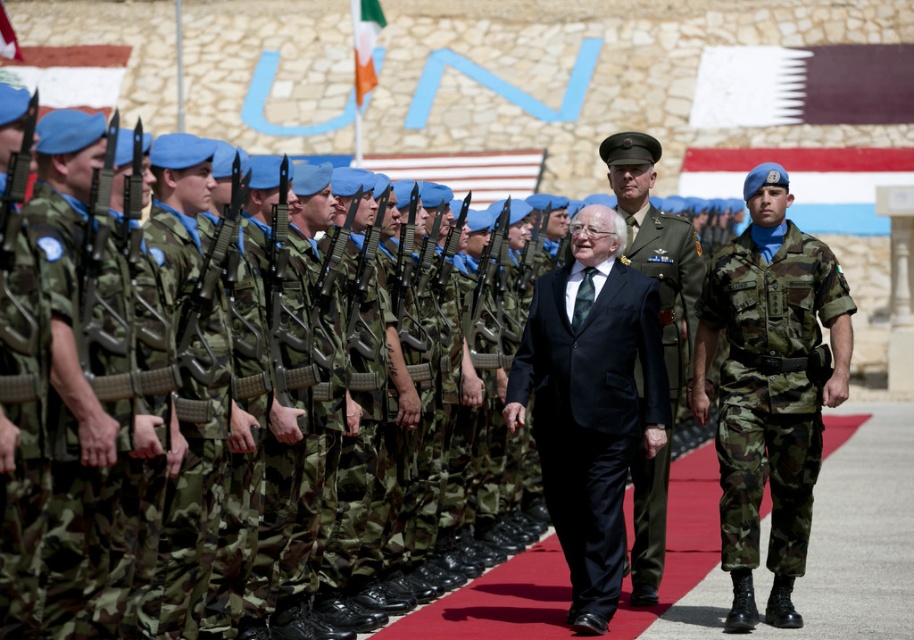
Can you confirm if camo fabric uniform at right is wider than black velvet suit at center?

Correct, the width of camo fabric uniform at right exceeds that of black velvet suit at center.

Who is positioned more to the left, camo fabric uniform at right or black velvet suit at center?

black velvet suit at center is more to the left.

Where is `camo fabric uniform at right`? camo fabric uniform at right is located at coordinates (769, 388).

Locate an element on the screen. camo fabric uniform at right is located at coordinates (769, 388).

Does black velvet suit at center have a greater width compared to green uniform at center?

No, black velvet suit at center is not wider than green uniform at center.

Does black velvet suit at center appear under green uniform at center?

Yes, black velvet suit at center is below green uniform at center.

The width and height of the screenshot is (914, 640). I want to click on black velvet suit at center, so click(x=590, y=417).

Is point (788, 540) positioned after point (646, 550)?

No.

Based on the photo, who is shorter, camo fabric uniform at right or green uniform at center?

Standing shorter between the two is camo fabric uniform at right.

Measure the distance between point (804, 540) and camera.

Point (804, 540) is 116.65 feet away from camera.

Locate an element on the screen. The image size is (914, 640). camo fabric uniform at right is located at coordinates (769, 388).